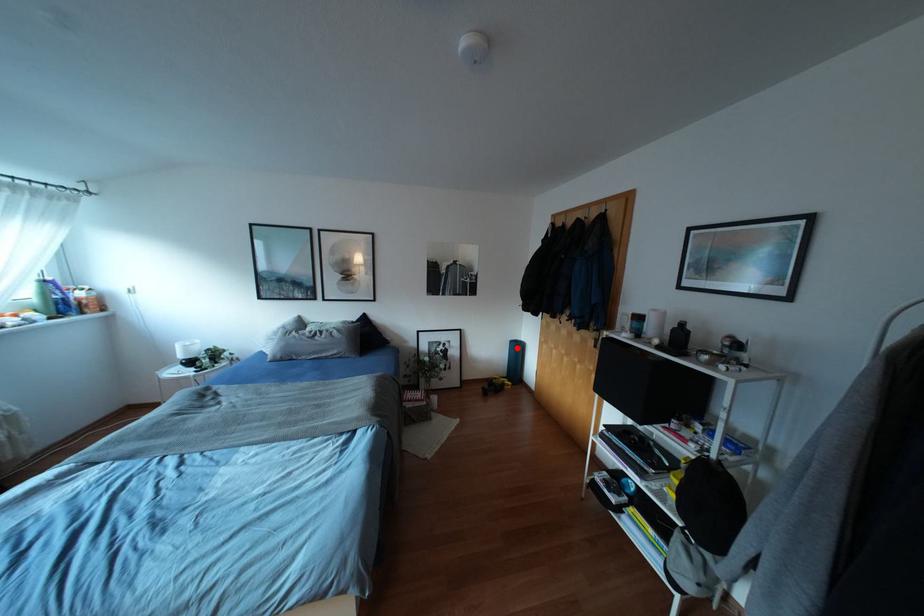
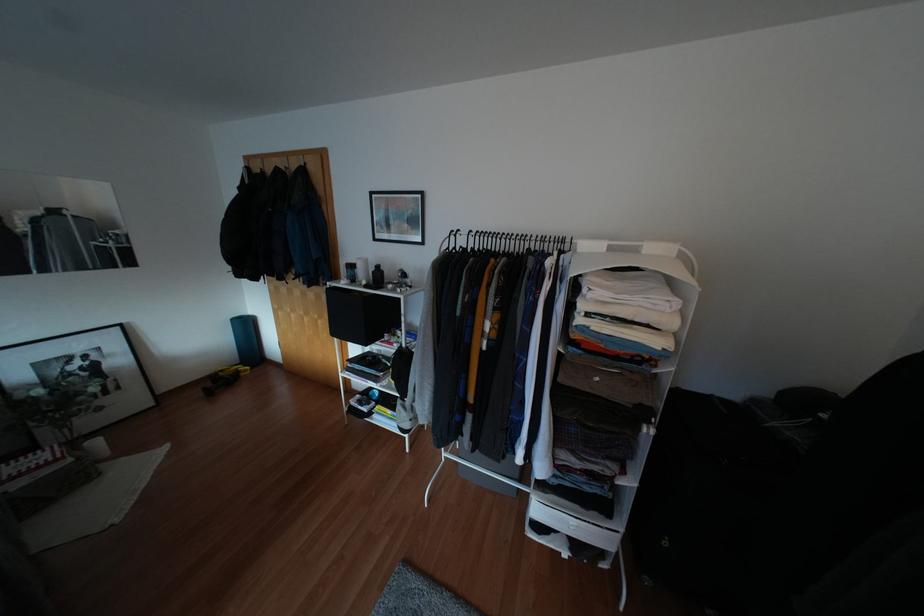
Find the pixel in the second image that matches the highlighted location in the first image.

(246, 325)